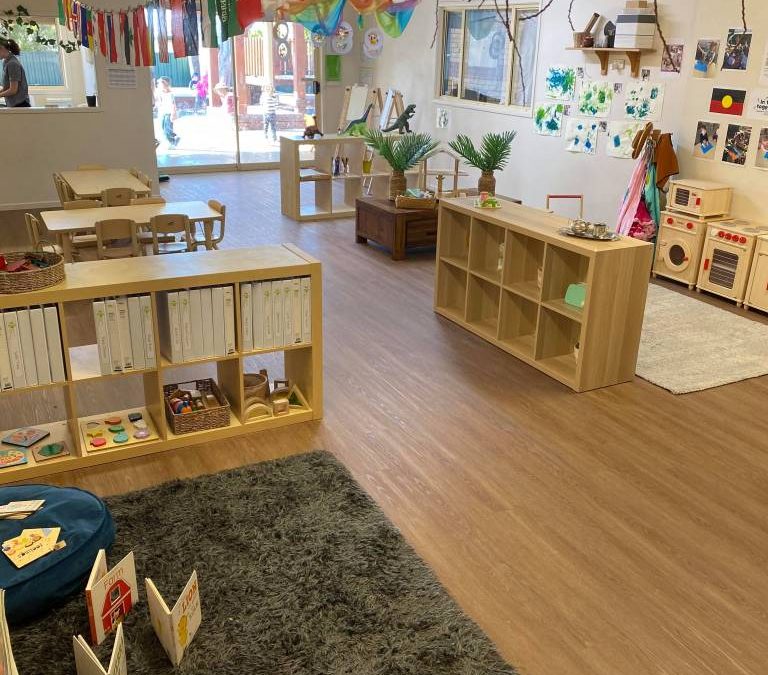
The image size is (768, 675). I want to click on cabinet with squares, so click(608, 288).